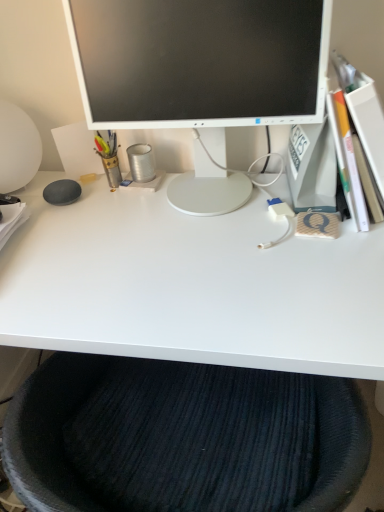
The width and height of the screenshot is (384, 512). What are the coordinates of `free space in front of white glossy monitor at center` in the screenshot? It's located at (224, 262).